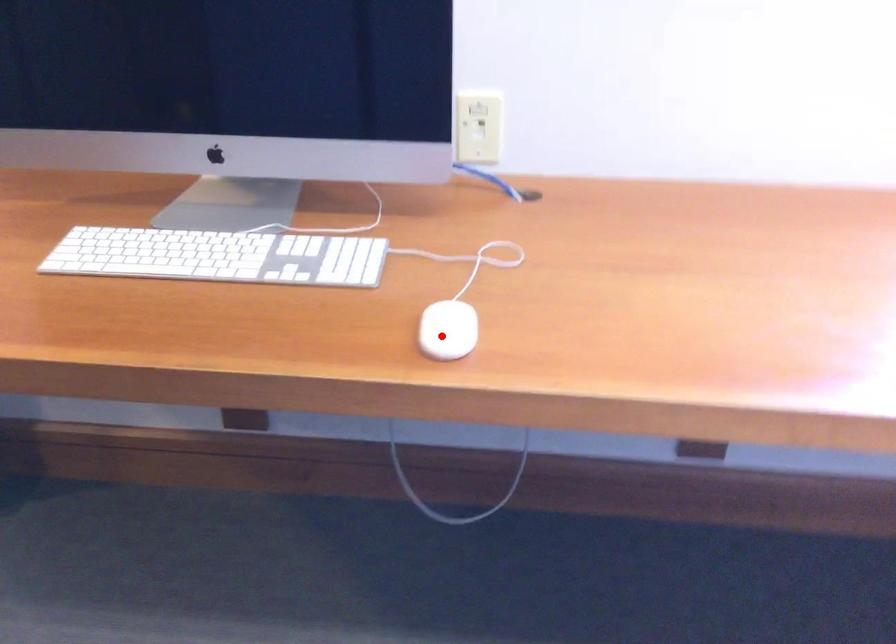
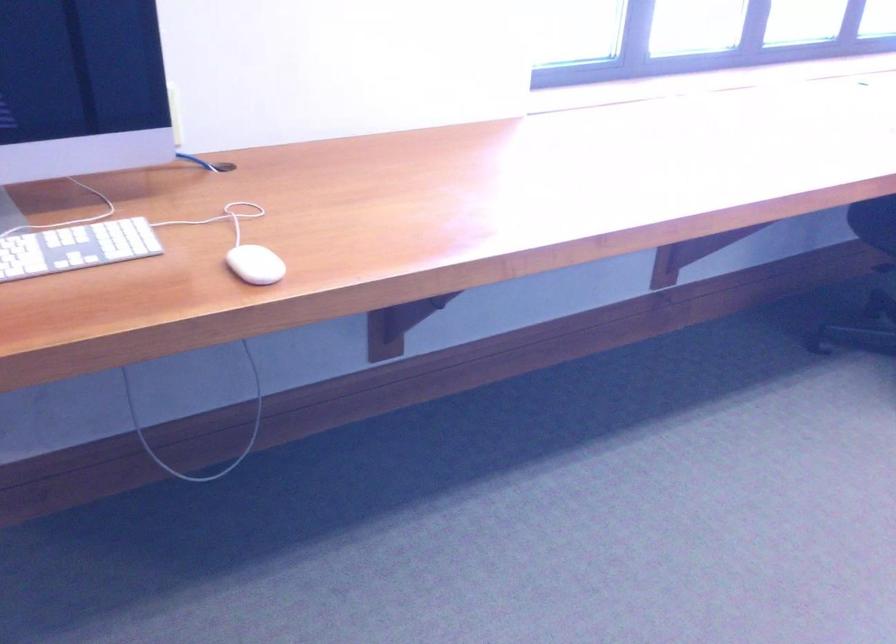
The point at the highlighted location is marked in the first image. Where is the corresponding point in the second image?

(254, 265)